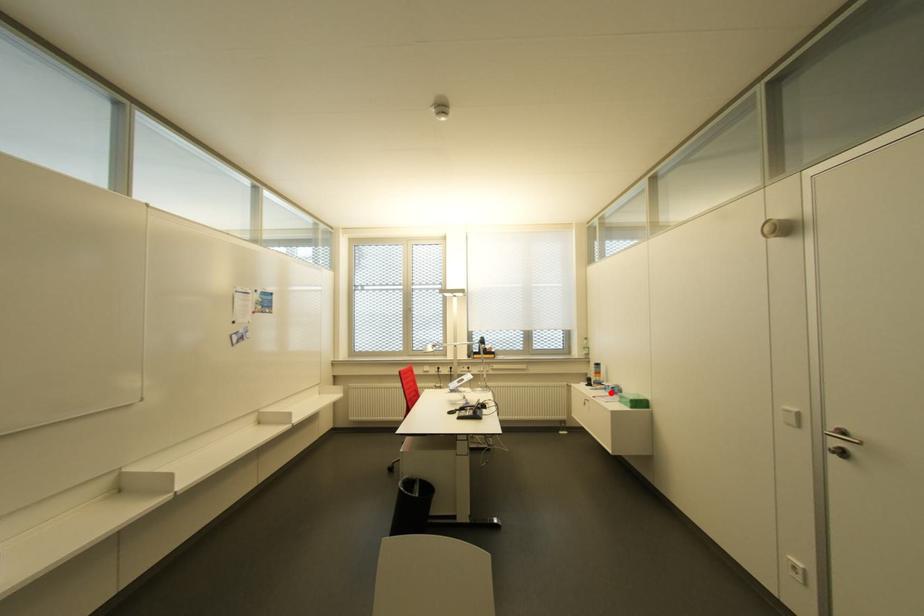
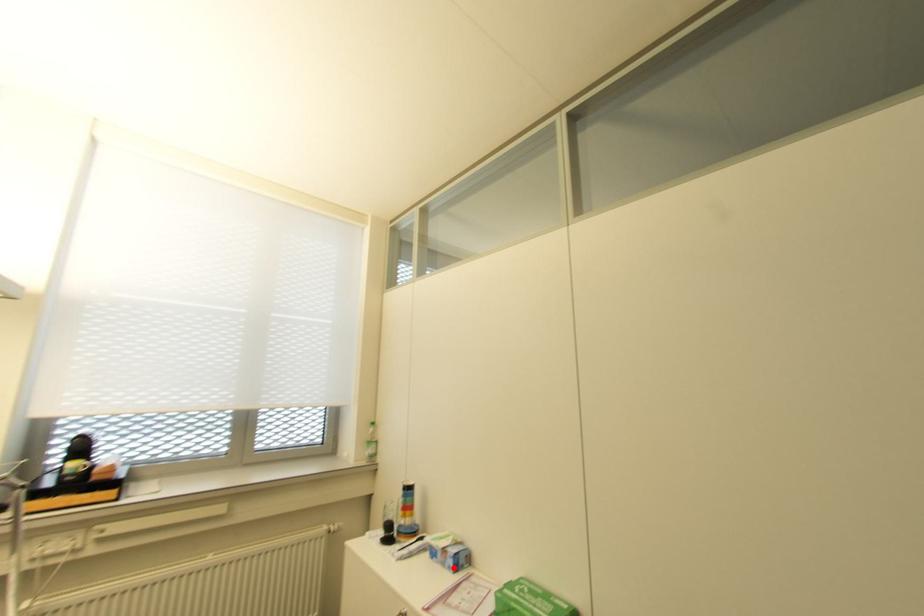
I am providing you with two images of the same scene from different viewpoints. A red point is marked on the first image and another point is marked on the second image. Does the point marked in image1 correspond to the same location as the one in image2?

Yes